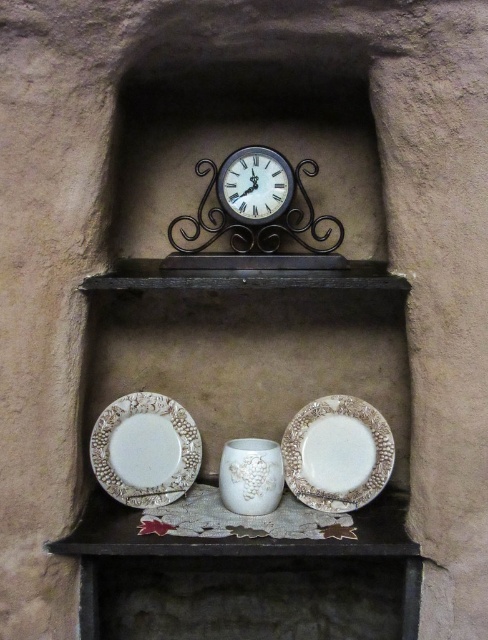
You are standing in front of the rustic wall shelf and want to determine the position of two points on the shelf. Which point is closer to you, point (363, 452) or point (263, 216)?

Point (263, 216) is closer to you because it is less further to the camera than point (363, 452).